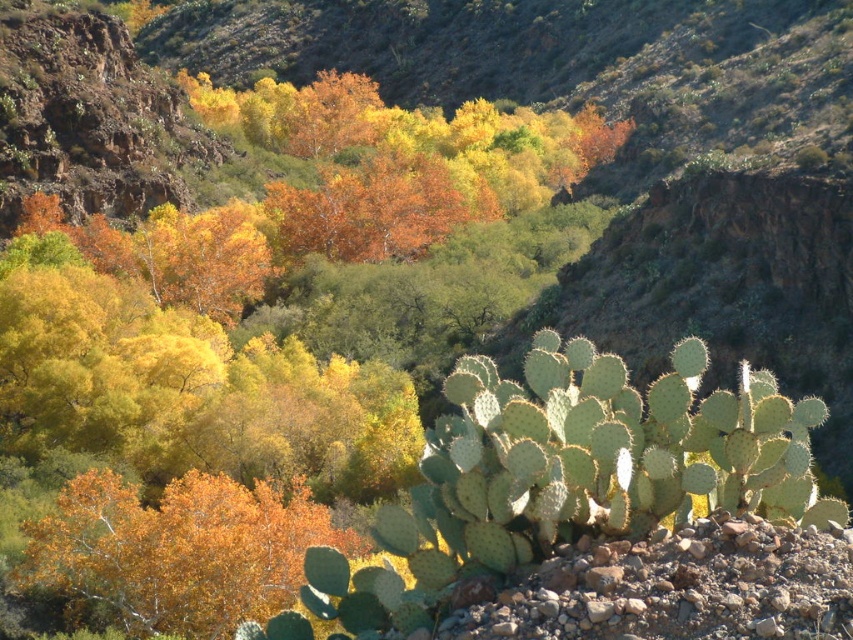
Can you confirm if golden textured leaves at center is thinner than green spiny cactus at lower right?

Yes, golden textured leaves at center is thinner than green spiny cactus at lower right.

Is point (126, 496) behind point (471, 625)?

Yes, it is behind point (471, 625).

Where is `golden textured leaves at center`? The width and height of the screenshot is (853, 640). golden textured leaves at center is located at coordinates (178, 550).